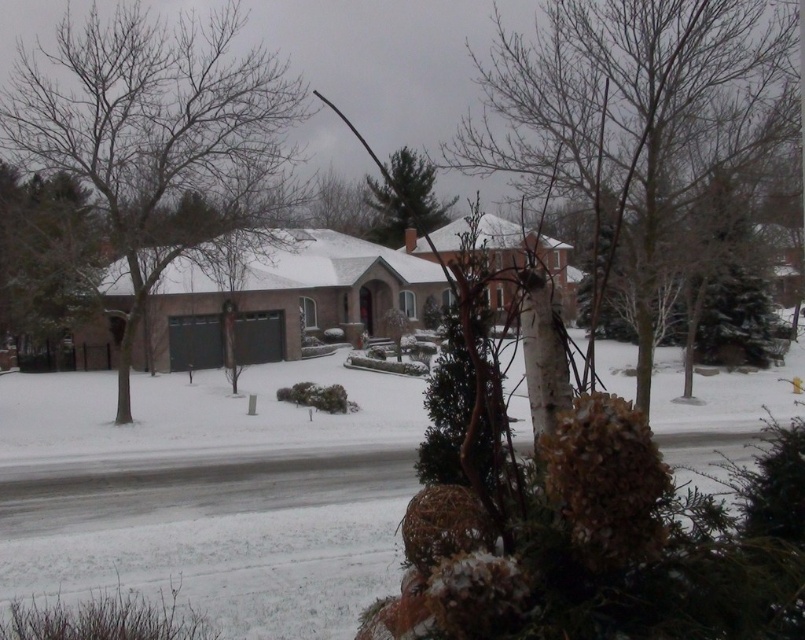
Question: Can you confirm if bare wood tree at center is positioned below green matte tree at center?

Choices:
 (A) no
 (B) yes

Answer: (A)

Question: Does brown leafless tree at left have a larger size compared to green textured evergreen tree at upper left?

Choices:
 (A) yes
 (B) no

Answer: (A)

Question: Among these objects, which one is farthest from the camera?

Choices:
 (A) green matte tree at center
 (B) green textured evergreen tree at upper left

Answer: (B)

Question: In this image, where is bare wood tree at center located relative to brown leafless tree at left?

Choices:
 (A) right
 (B) left

Answer: (A)

Question: Based on their relative distances, which object is farther from the brown leafless tree at left?

Choices:
 (A) green textured evergreen tree at upper left
 (B) bare wood tree at center
 (C) green matte tree at center

Answer: (C)

Question: Which of these objects is positioned farthest from the green textured evergreen tree at upper left?

Choices:
 (A) brown leafless tree at left
 (B) green matte tree at center
 (C) bare wood tree at center

Answer: (B)